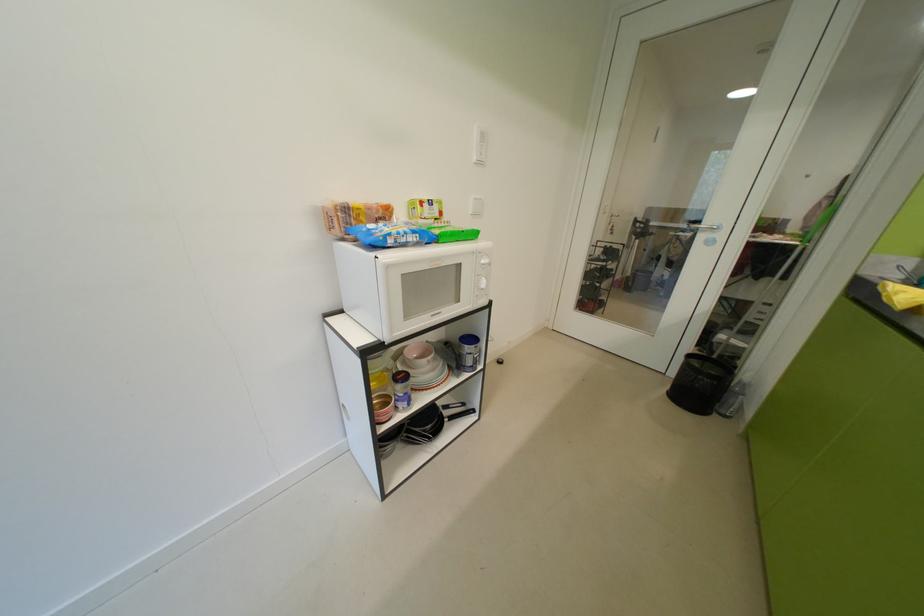
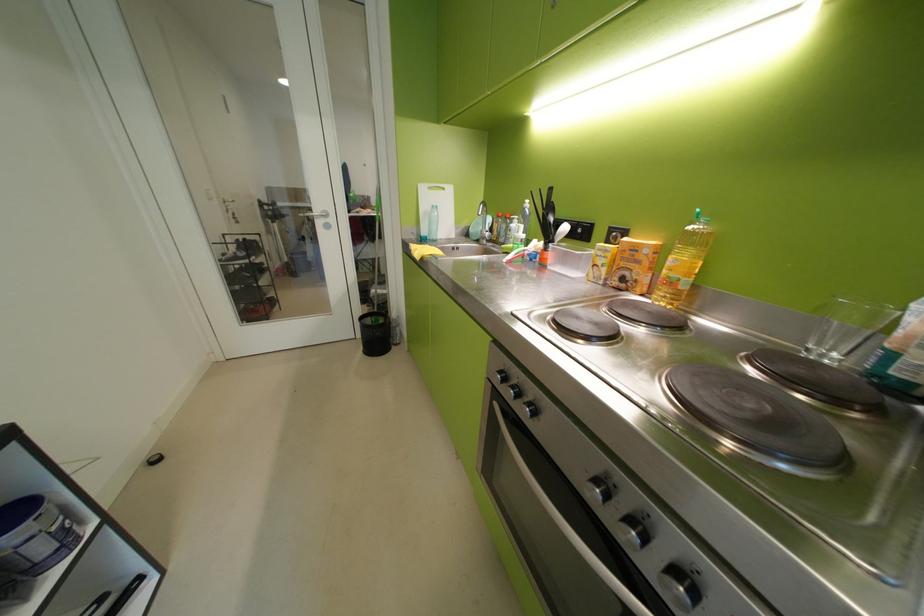
Find the pixel in the second image that matches point (684, 374) in the first image.

(370, 336)